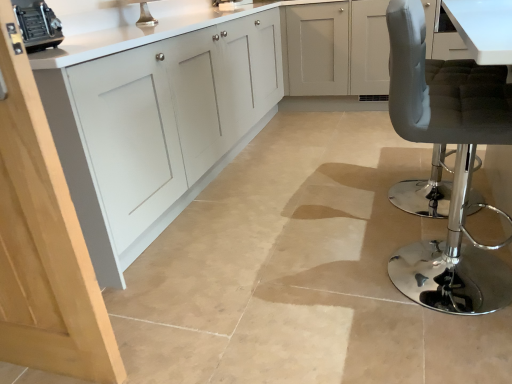
Question: Considering the positions of metallic silver toaster at upper left and matte gray cushioned stool at right in the image, is metallic silver toaster at upper left bigger or smaller than matte gray cushioned stool at right?

Choices:
 (A) small
 (B) big

Answer: (A)

Question: In the image, is metallic silver toaster at upper left positioned in front of or behind matte gray cushioned stool at right?

Choices:
 (A) behind
 (B) front

Answer: (A)

Question: Which object is the closest to the matte gray cushioned stool at right?

Choices:
 (A) metallic silver toaster at upper left
 (B) matte white cabinets at center

Answer: (B)

Question: Estimate the real-world distances between objects in this image. Which object is closer to the matte gray cushioned stool at right?

Choices:
 (A) metallic silver toaster at upper left
 (B) matte white cabinets at center

Answer: (B)